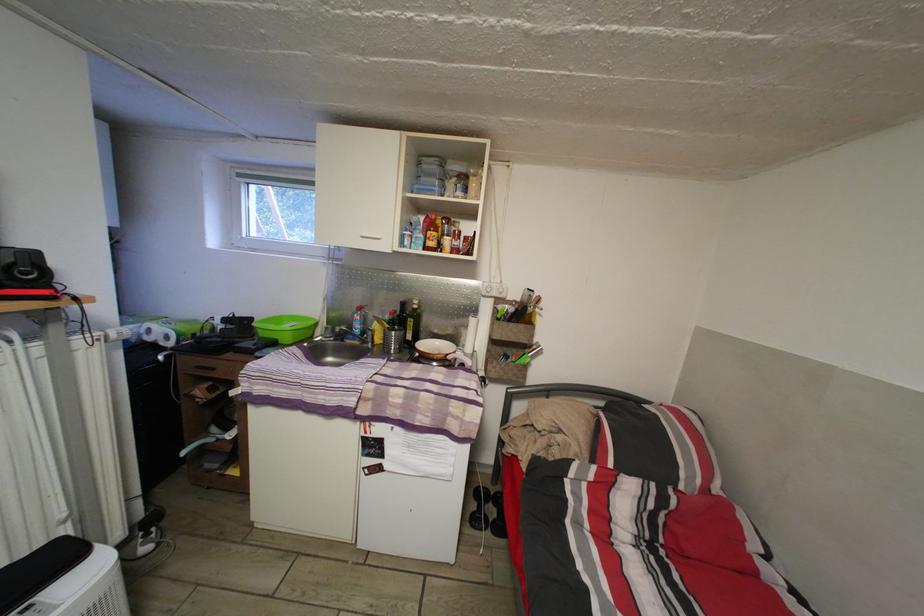
The image size is (924, 616). Identify the location of dark green bottle. (412, 323).